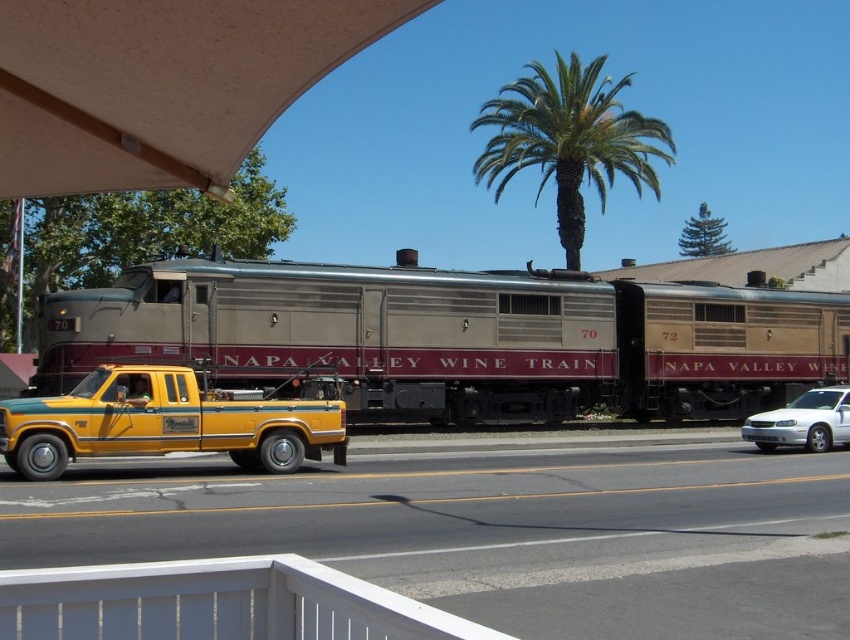
Question: Which point appears closest to the camera in this image?

Choices:
 (A) (485, 104)
 (B) (319, 577)
 (C) (136, 294)

Answer: (B)

Question: Does yellow matte truck at lower left come behind white glossy sedan at center?

Choices:
 (A) no
 (B) yes

Answer: (A)

Question: Which is farther from the yellow matte truck at lower left?

Choices:
 (A) white glossy sedan at center
 (B) white wooden rail at lower center

Answer: (A)

Question: Which of the following is the farthest from the observer?

Choices:
 (A) (30, 385)
 (B) (579, 243)

Answer: (B)

Question: Does white wooden rail at lower center appear on the right side of yellow matte truck at lower left?

Choices:
 (A) yes
 (B) no

Answer: (A)

Question: Can you confirm if silver metallic train at center is thinner than white glossy sedan at center?

Choices:
 (A) no
 (B) yes

Answer: (A)